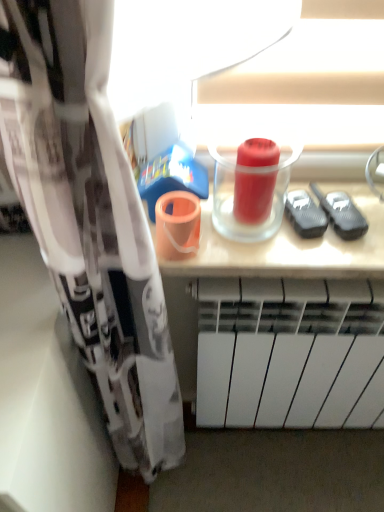
Question: Considering the relative positions of red matte cup at center and white matte radiator at lower center in the image provided, is red matte cup at center behind white matte radiator at lower center?

Choices:
 (A) yes
 (B) no

Answer: (B)

Question: From a real-world perspective, does red matte cup at center sit lower than white matte radiator at lower center?

Choices:
 (A) yes
 (B) no

Answer: (B)

Question: From the image's perspective, does red matte cup at center appear lower than white matte radiator at lower center?

Choices:
 (A) yes
 (B) no

Answer: (B)

Question: Considering the relative positions of red matte cup at center and white matte radiator at lower center in the image provided, is red matte cup at center to the left of white matte radiator at lower center from the viewer's perspective?

Choices:
 (A) no
 (B) yes

Answer: (B)

Question: From a real-world perspective, is red matte cup at center over white matte radiator at lower center?

Choices:
 (A) yes
 (B) no

Answer: (A)

Question: Would you consider red matte cup at center to be distant from white matte radiator at lower center?

Choices:
 (A) no
 (B) yes

Answer: (A)

Question: Can you confirm if white matte radiator at lower center is bigger than red matte cup at center?

Choices:
 (A) no
 (B) yes

Answer: (B)

Question: Can we say white matte radiator at lower center lies outside red matte cup at center?

Choices:
 (A) no
 (B) yes

Answer: (B)

Question: Could you tell me if white matte radiator at lower center is turned towards red matte cup at center?

Choices:
 (A) yes
 (B) no

Answer: (B)

Question: Is white matte radiator at lower center closer to camera compared to red matte cup at center?

Choices:
 (A) yes
 (B) no

Answer: (B)

Question: Are white matte radiator at lower center and red matte cup at center located far from each other?

Choices:
 (A) no
 (B) yes

Answer: (A)

Question: From the image's perspective, is white matte radiator at lower center beneath red matte cup at center?

Choices:
 (A) no
 (B) yes

Answer: (B)

Question: From a real-world perspective, is red matte cup at center physically located above or below white matte radiator at lower center?

Choices:
 (A) above
 (B) below

Answer: (A)